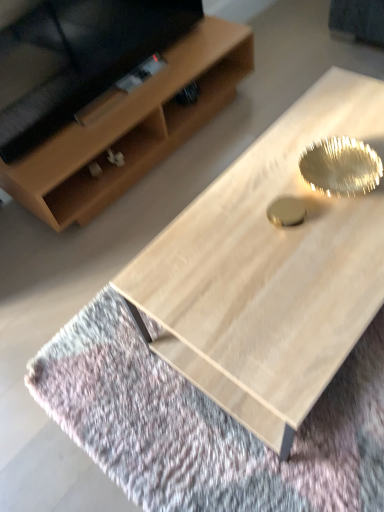
What is the approximate height of light brown wood shelf at upper left?

It is 12.43 inches.

Measure the distance between point (203,93) and camera.

Point (203,93) and camera are 1.93 meters apart from each other.

What do you see at coordinates (131, 128) in the screenshot?
I see `light brown wood shelf at upper left` at bounding box center [131, 128].

You are a GUI agent. You are given a task and a screenshot of the screen. Output one action in this format:
    pyautogui.click(x=<x>, y=<y>)
    Task: Click on the light brown wood shelf at upper left
    Image resolution: width=384 pixels, height=512 pixels.
    Given the screenshot: What is the action you would take?
    pyautogui.click(x=131, y=128)

This screenshot has width=384, height=512. What do you see at coordinates (270, 271) in the screenshot?
I see `light wood coffee table at center` at bounding box center [270, 271].

Where is `light wood coffee table at center`? This screenshot has height=512, width=384. light wood coffee table at center is located at coordinates (270, 271).

I want to click on light brown wood shelf at upper left, so click(131, 128).

Would you say light wood coffee table at center is to the left or to the right of light brown wood shelf at upper left in the picture?

light wood coffee table at center is to the right of light brown wood shelf at upper left.

Is the depth of light wood coffee table at center less than that of light brown wood shelf at upper left?

Yes.

Is point (286, 124) positioned behind point (57, 228)?

No, it is in front of (57, 228).

From the image's perspective, does light wood coffee table at center appear lower than light brown wood shelf at upper left?

Yes, from the image's perspective, light wood coffee table at center is below light brown wood shelf at upper left.

From a real-world perspective, is light wood coffee table at center positioned under light brown wood shelf at upper left based on gravity?

Actually, light wood coffee table at center is physically above light brown wood shelf at upper left in the real world.

Which object is thinner, light wood coffee table at center or light brown wood shelf at upper left?

light brown wood shelf at upper left.

Considering the sizes of objects light wood coffee table at center and light brown wood shelf at upper left in the image provided, who is shorter, light wood coffee table at center or light brown wood shelf at upper left?

light brown wood shelf at upper left.

Is light wood coffee table at center bigger or smaller than light brown wood shelf at upper left?

Clearly, light wood coffee table at center is larger in size than light brown wood shelf at upper left.

Is light brown wood shelf at upper left completely or partially inside light wood coffee table at center?

That's incorrect, light brown wood shelf at upper left is not inside light wood coffee table at center.

Is light wood coffee table at center far away from light brown wood shelf at upper left?

Answer: No, light wood coffee table at center is not far from light brown wood shelf at upper left.

Could you tell me if light wood coffee table at center is facing light brown wood shelf at upper left?

Yes, light wood coffee table at center is turned towards light brown wood shelf at upper left.

What's the angular difference between light wood coffee table at center and light brown wood shelf at upper left's facing directions?

There is a 179-degree angle between the facing directions of light wood coffee table at center and light brown wood shelf at upper left.

Identify the location of shelf that appears behind the light wood coffee table at center. (131, 128).

Is light brown wood shelf at upper left to the right of light wood coffee table at center from the viewer's perspective?

No, light brown wood shelf at upper left is not to the right of light wood coffee table at center.

Between light brown wood shelf at upper left and light wood coffee table at center, which one is positioned in front?

light wood coffee table at center is closer to the camera.

Between point (248, 72) and point (303, 278), which one is positioned behind?

Positioned behind is point (248, 72).

From the image's perspective, is light brown wood shelf at upper left beneath light wood coffee table at center?

Actually, light brown wood shelf at upper left appears above light wood coffee table at center in the image.

From a real-world perspective, does light brown wood shelf at upper left stand above light wood coffee table at center?

No, from a real-world perspective, light brown wood shelf at upper left is not above light wood coffee table at center.

Can you confirm if light brown wood shelf at upper left is thinner than light wood coffee table at center?

Yes.

Which of these two, light brown wood shelf at upper left or light wood coffee table at center, stands shorter?

light brown wood shelf at upper left.

Based on their sizes in the image, would you say light brown wood shelf at upper left is bigger or smaller than light wood coffee table at center?

Clearly, light brown wood shelf at upper left is smaller in size than light wood coffee table at center.

Is light brown wood shelf at upper left positioned beyond the bounds of light wood coffee table at center?

Yes, light brown wood shelf at upper left is not within light wood coffee table at center.

Are light brown wood shelf at upper left and light wood coffee table at center located far from each other?

No, there isn't a large distance between light brown wood shelf at upper left and light wood coffee table at center.

Is light brown wood shelf at upper left turned away from light wood coffee table at center?

No, light brown wood shelf at upper left is not facing the opposite direction of light wood coffee table at center.

You are a GUI agent. You are given a task and a screenshot of the screen. Output one action in this format:
    pyautogui.click(x=<x>, y=<y>)
    Task: Click on the shelf behind the light wood coffee table at center
    This screenshot has width=384, height=512.
    Given the screenshot: What is the action you would take?
    pyautogui.click(x=131, y=128)

Identify the location of shelf that appears above the light wood coffee table at center (from the image's perspective). (131, 128).

At what (x,y) coordinates should I click in order to perform the action: click on coffee table in front of the light brown wood shelf at upper left. Please return your answer as a coordinate pair (x, y). The width and height of the screenshot is (384, 512). Looking at the image, I should click on (270, 271).